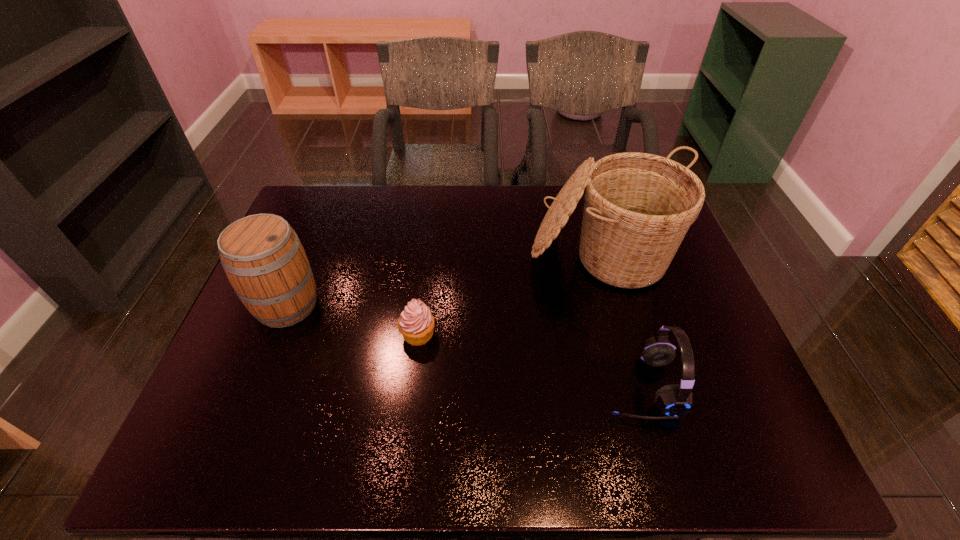
This screenshot has height=540, width=960. I want to click on vacant space that satisfies the following two spatial constraints: 1. on the front side of the third object from right to left; 2. on the left side of the second tallest object, so click(x=275, y=334).